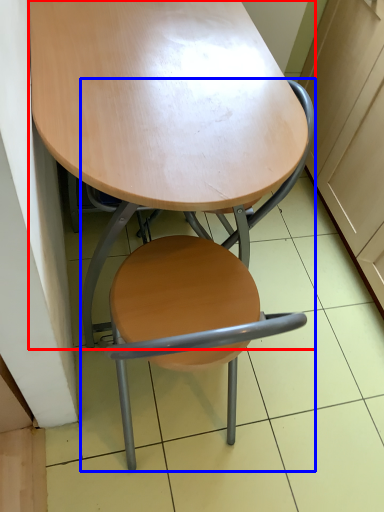
Question: Which object is closer to the camera taking this photo, table (highlighted by a red box) or chair (highlighted by a blue box)?

Choices:
 (A) table
 (B) chair

Answer: (B)